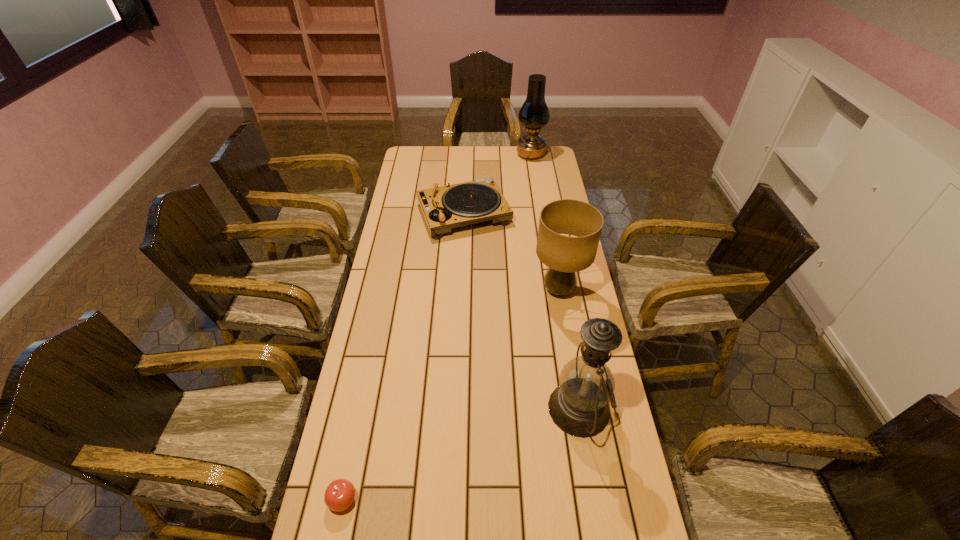
Where is `free space at the far left corner of the desktop`? This screenshot has width=960, height=540. free space at the far left corner of the desktop is located at coordinates (402, 171).

Find the location of a particular element. free location at the far right corner of the desktop is located at coordinates (536, 167).

The width and height of the screenshot is (960, 540). In order to click on free space between the farthest object and the leftmost object in this screenshot , I will do `click(437, 327)`.

Image resolution: width=960 pixels, height=540 pixels. Find the location of `vacant area that lies between the third nearest object and the fourth nearest object`. vacant area that lies between the third nearest object and the fourth nearest object is located at coordinates (512, 252).

You are a GUI agent. You are given a task and a screenshot of the screen. Output one action in this format:
    pyautogui.click(x=<x>, y=<y>)
    Task: Click on the vacant point located between the second farthest object and the second nearest object
    
    Given the screenshot: What is the action you would take?
    pyautogui.click(x=521, y=311)

Where is `blank region between the third nearest object and the fourth farthest object`? The width and height of the screenshot is (960, 540). blank region between the third nearest object and the fourth farthest object is located at coordinates (568, 349).

What are the coordinates of `vacant space in between the farthest object and the shortest object` in the screenshot? It's located at [437, 327].

The width and height of the screenshot is (960, 540). I want to click on free space between the farther oil lamp and the record player, so click(x=497, y=184).

Locate an element on the screen. The image size is (960, 540). free space between the apple and the fourth farthest object is located at coordinates (461, 454).

Find the location of a particular element. The image size is (960, 540). empty space that is in between the farthest object and the fourth object from right to left is located at coordinates (497, 184).